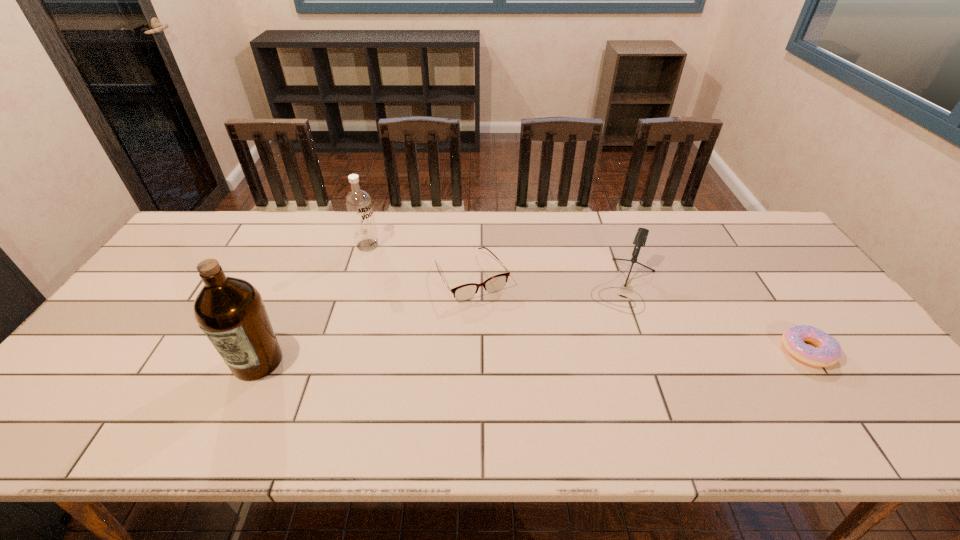
The width and height of the screenshot is (960, 540). I want to click on vacant space on the desktop that is between the leftmost object and the doughnut and is positioned on the stand of the third shortest object, so click(596, 355).

I want to click on vacant space on the desktop that is between the tallest object and the rightmost object and is positioned on the face of the spectacles, so click(x=520, y=356).

Image resolution: width=960 pixels, height=540 pixels. What are the coordinates of `vacant space on the desktop that is between the leftmost object and the rightmost object and is positioned on the front label of the vodka` in the screenshot? It's located at (523, 356).